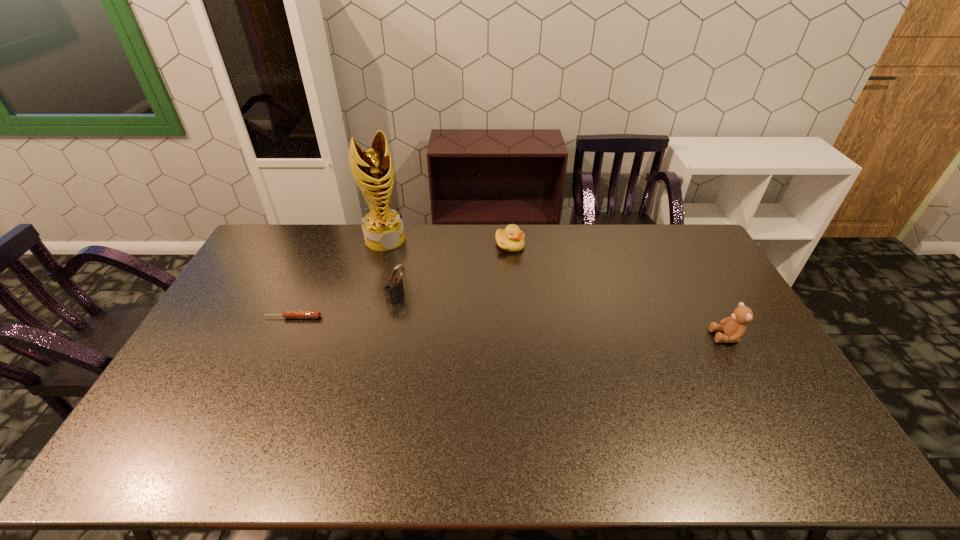
Identify the location of blank region between the award and the fourth tallest object. This screenshot has width=960, height=540. (447, 242).

The height and width of the screenshot is (540, 960). Find the location of `free space that is in between the second object from right to left and the award`. free space that is in between the second object from right to left and the award is located at coordinates (447, 242).

This screenshot has width=960, height=540. Find the location of `vacant space that is in between the second shortest object and the award`. vacant space that is in between the second shortest object and the award is located at coordinates (447, 242).

You are a GUI agent. You are given a task and a screenshot of the screen. Output one action in this format:
    pyautogui.click(x=<x>, y=<y>)
    Task: Click on the empty space that is in between the teddy bear and the sausage
    
    Given the screenshot: What is the action you would take?
    pyautogui.click(x=510, y=327)

The image size is (960, 540). In order to click on free space between the tallest object and the teddy bear in this screenshot , I will do `click(556, 288)`.

At what (x,y) coordinates should I click in order to perform the action: click on vacant space that's between the padlock and the award. Please return your answer as a coordinate pair (x, y). This screenshot has height=540, width=960. Looking at the image, I should click on (391, 267).

Find the location of a particular element. vacant area that lies between the leftmost object and the award is located at coordinates (339, 278).

Select which object is the fourth closest to the rightmost object. Please provide its 2D coordinates. Your answer should be formatted as a tuple, i.e. [(x, y)], where the tuple contains the x and y coordinates of a point satisfying the conditions above.

[(287, 314)]

Choose which object is the second nearest neighbor to the padlock. Please provide its 2D coordinates. Your answer should be formatted as a tuple, i.e. [(x, y)], where the tuple contains the x and y coordinates of a point satisfying the conditions above.

[(383, 229)]

Find the location of a particular element. Image resolution: width=960 pixels, height=540 pixels. free point that satisfies the following two spatial constraints: 1. on the front side of the rightmost object; 2. on the face of the award is located at coordinates (358, 336).